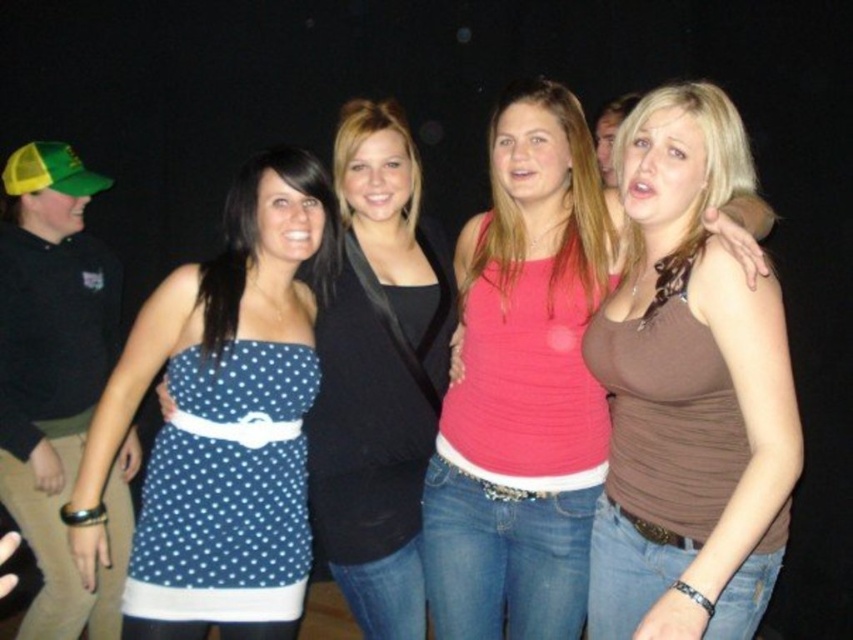
Question: In this image, where is brown matte tank top at center located relative to blue polka dot dress at center?

Choices:
 (A) above
 (B) below

Answer: (B)

Question: From the image, what is the correct spatial relationship of brown matte tank top at center in relation to blue polka dot dress at left?

Choices:
 (A) above
 (B) below

Answer: (A)

Question: Among these objects, which one is nearest to the camera?

Choices:
 (A) blue polka dot dress at left
 (B) blue polka dot dress at center
 (C) brown matte tank top at center

Answer: (A)

Question: Which of these objects is positioned closest to the blue polka dot dress at left?

Choices:
 (A) brown matte tank top at center
 (B) blue polka dot dress at center

Answer: (B)

Question: Which object is closer to the camera taking this photo?

Choices:
 (A) brown matte tank top at center
 (B) blue polka dot dress at center

Answer: (A)

Question: Does brown matte tank top at center appear over blue polka dot dress at center?

Choices:
 (A) yes
 (B) no

Answer: (B)